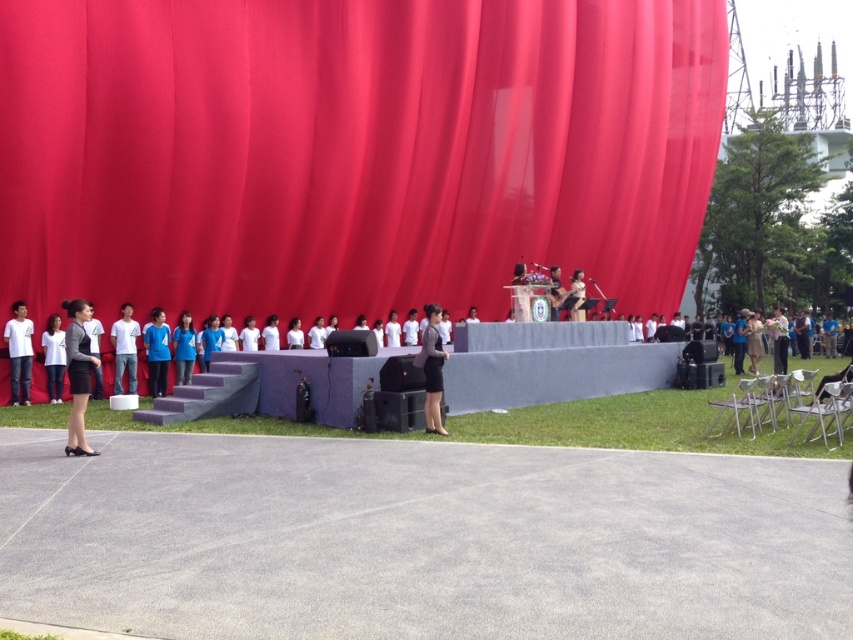
Question: Which is nearer to the white matte shirt at left?

Choices:
 (A) black fabric at right
 (B) matte red curtain at center

Answer: (B)

Question: Can you confirm if white matte shirt at left is thinner than white matte shirt at center?

Choices:
 (A) yes
 (B) no

Answer: (A)

Question: Is white matte shirt at left thinner than white matte shirt at center?

Choices:
 (A) yes
 (B) no

Answer: (A)

Question: Does matte red curtain at center have a greater width compared to white matte shirt at left?

Choices:
 (A) no
 (B) yes

Answer: (B)

Question: Which point appears closest to the camera in this image?

Choices:
 (A) (6, 339)
 (B) (270, 136)
 (C) (119, 344)

Answer: (A)

Question: Considering the real-world distances, which object is closest to the black fabric at right?

Choices:
 (A) white matte shirt at left
 (B) matte red curtain at center

Answer: (B)